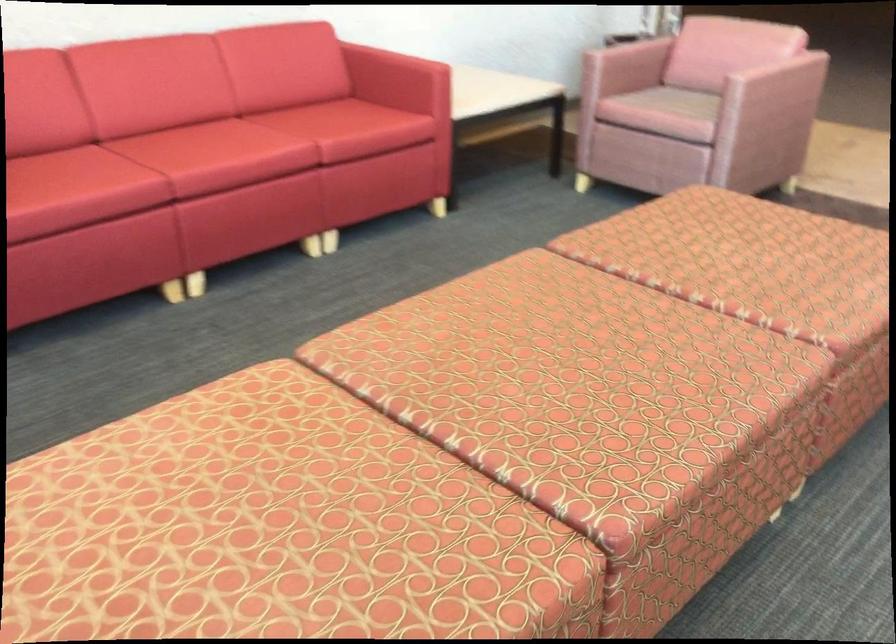
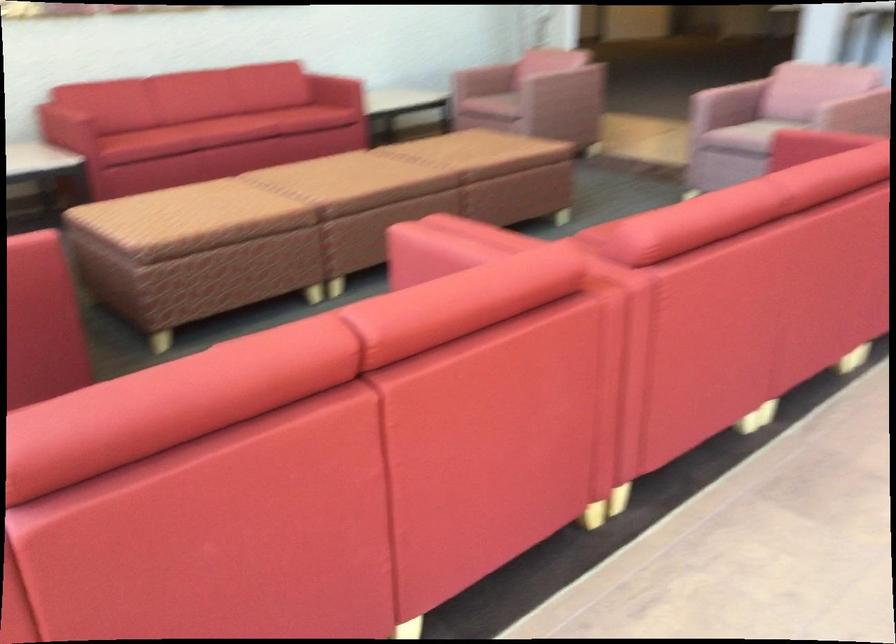
In a continuous first-person perspective shot, in which direction is the camera moving?

The movement direction of the cameraman is right, backward.